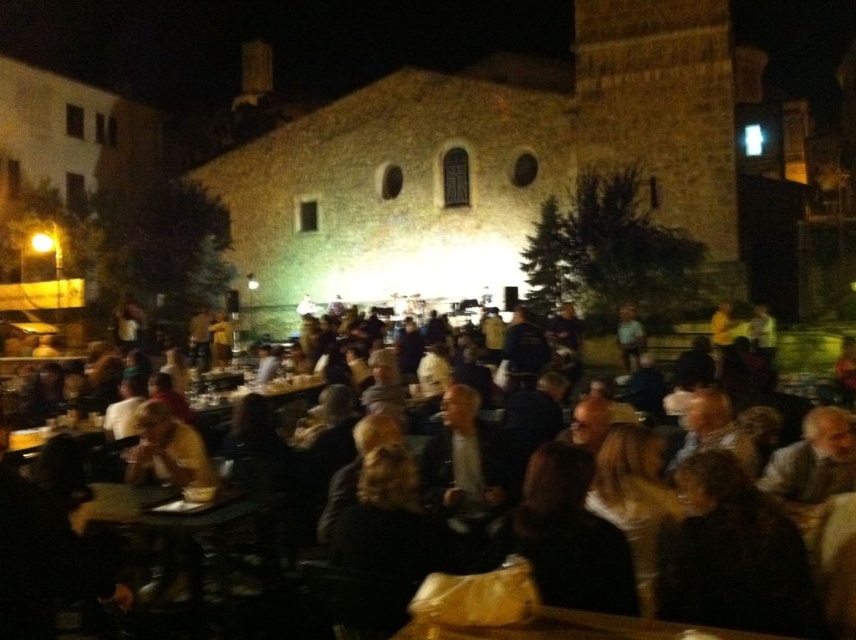
Which is behind, point (805, 358) or point (181, 540)?

The point (805, 358) is more distant.

Does dark brown leather chairs at center come behind wooden table at lower left?

Yes, dark brown leather chairs at center is behind wooden table at lower left.

This screenshot has height=640, width=856. What do you see at coordinates (812, 355) in the screenshot?
I see `dark brown leather chairs at center` at bounding box center [812, 355].

At what (x,y) coordinates should I click in order to perform the action: click on dark brown leather chairs at center. Please return your answer as a coordinate pair (x, y). The width and height of the screenshot is (856, 640). Looking at the image, I should click on (812, 355).